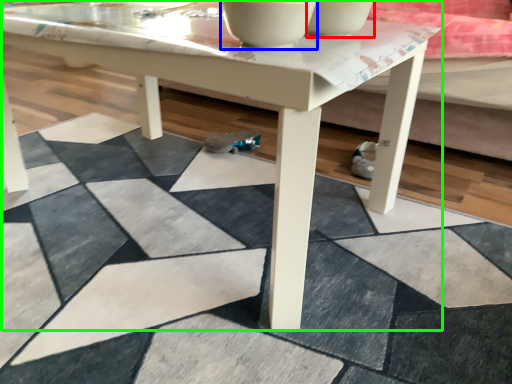
Question: Estimate the real-world distances between objects in this image. Which object is closer to bowl (highlighted by a red box), bowl (highlighted by a blue box) or coffee table (highlighted by a green box)?

Choices:
 (A) bowl
 (B) coffee table

Answer: (A)